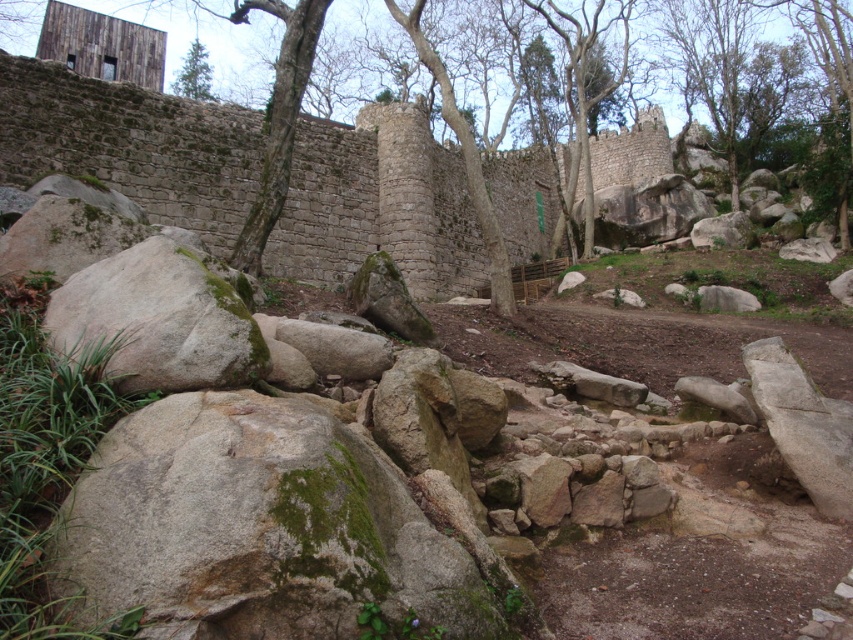
You are a hiker standing at the base of the green mossy rock at lower left and want to reach the green matte tree at upper left. Which direction should you move to get closer to the tree?

The green mossy rock at lower left is located below the green matte tree at upper left, so you should move upward to get closer to the tree.

You are a hiker who wants to take a photo of the green mossy rock at lower left and the green matte tree at upper left. To ensure both are in focus, you need to know which one is closer to you. Can you determine which object is nearer?

The green mossy rock at lower left is nearer to you than the green matte tree at upper left because it has a lesser height, indicating it is closer in the scene.

You are standing at the point labeled point (245, 344) and want to walk towards the point labeled point (216, 100). Which direction should you move to get closer to your destination?

Since point (245, 344) is closer to the camera than point (216, 100), you should move forward to get closer to your destination.